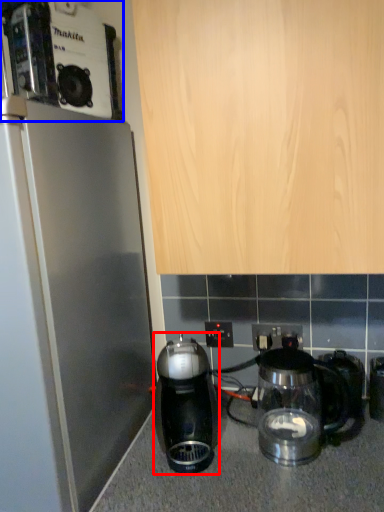
Question: Which object is closer to the camera taking this photo, kitchen appliance (highlighted by a red box) or coffee maker (highlighted by a blue box)?

Choices:
 (A) kitchen appliance
 (B) coffee maker

Answer: (B)